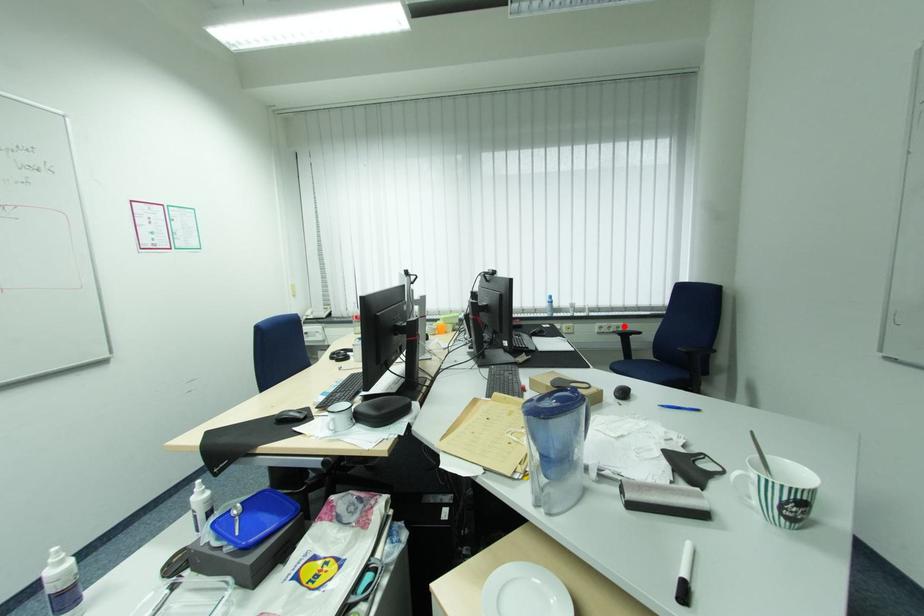
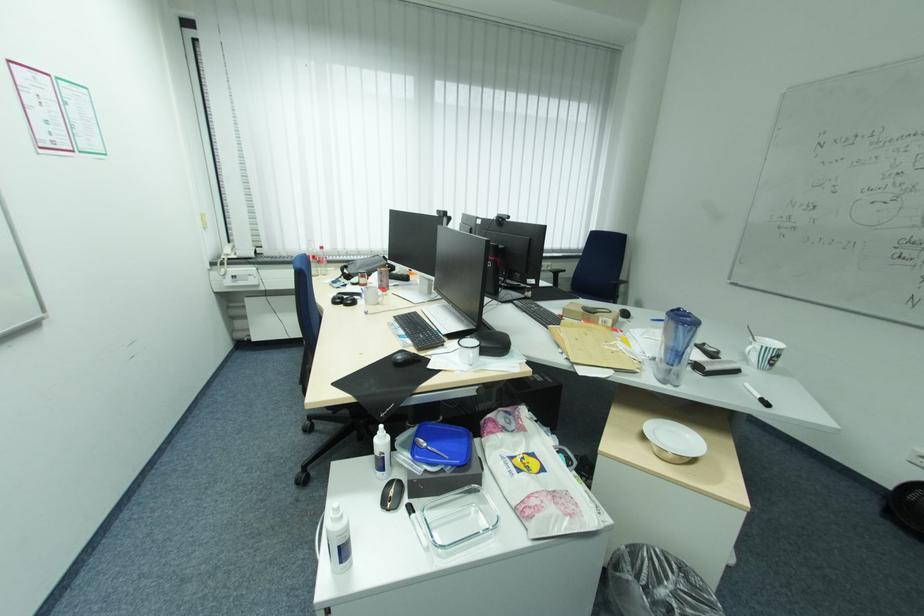
Question: I am providing you with two images of the same scene from different viewpoints. Given a red point in image1, look at the same physical point in image2. Is it:

Choices:
 (A) Closer to the viewpoint
 (B) Farther from the viewpoint

Answer: (B)